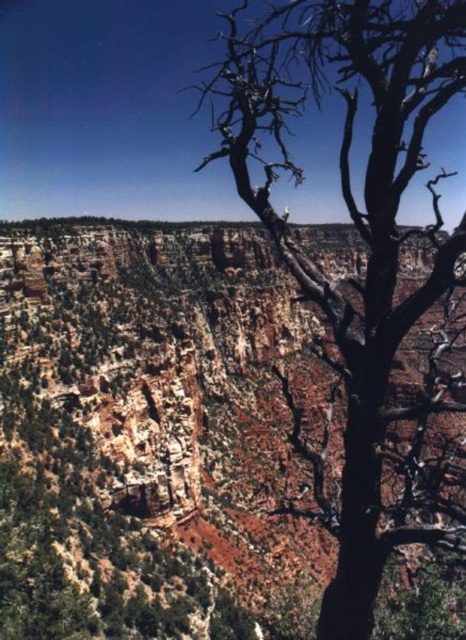
Question: Is rustic rock canyon at center positioned at the back of dead wood tree at right?

Choices:
 (A) no
 (B) yes

Answer: (B)

Question: Is rustic rock canyon at center smaller than dead wood tree at right?

Choices:
 (A) no
 (B) yes

Answer: (B)

Question: Which point is closer to the camera?

Choices:
 (A) (262, 205)
 (B) (105, 534)

Answer: (A)

Question: Is rustic rock canyon at center thinner than dead wood tree at right?

Choices:
 (A) no
 (B) yes

Answer: (B)

Question: Which of the following is the farthest from the observer?

Choices:
 (A) dead wood tree at right
 (B) rustic rock canyon at center

Answer: (B)